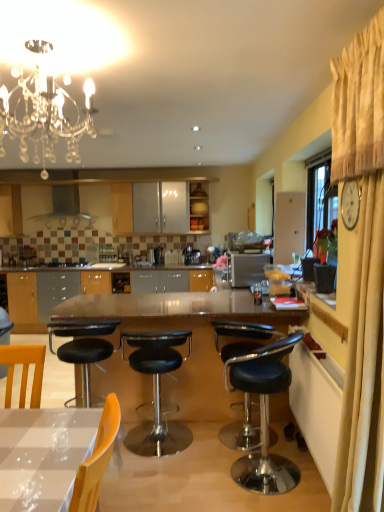
Question: Is satin silver coffee machine at center completely or partially inside satin silver range hood at upper center?

Choices:
 (A) yes
 (B) no

Answer: (B)

Question: Can you see satin silver range hood at upper center touching satin silver coffee machine at center?

Choices:
 (A) no
 (B) yes

Answer: (A)

Question: Does satin silver range hood at upper center appear on the left side of satin silver coffee machine at center?

Choices:
 (A) no
 (B) yes

Answer: (B)

Question: From the image's perspective, would you say satin silver range hood at upper center is shown under satin silver coffee machine at center?

Choices:
 (A) yes
 (B) no

Answer: (B)

Question: Does satin silver range hood at upper center come in front of satin silver coffee machine at center?

Choices:
 (A) no
 (B) yes

Answer: (B)

Question: Is point [x=241, y=262] closer or farther from the camera than point [x=190, y=184]?

Choices:
 (A) farther
 (B) closer

Answer: (B)

Question: Considering the positions of satin silver toaster at center and matte wood cabinet at center in the image, is satin silver toaster at center taller or shorter than matte wood cabinet at center?

Choices:
 (A) tall
 (B) short

Answer: (B)

Question: Choose the correct answer: Is satin silver toaster at center inside matte wood cabinet at center or outside it?

Choices:
 (A) outside
 (B) inside

Answer: (A)

Question: From a real-world perspective, relative to matte wood cabinet at center, is satin silver toaster at center vertically above or below?

Choices:
 (A) below
 (B) above

Answer: (A)

Question: Choose the correct answer: Is beige fabric curtain at right inside satin silver coffee machine at center or outside it?

Choices:
 (A) inside
 (B) outside

Answer: (B)

Question: Considering the positions of beige fabric curtain at right and satin silver coffee machine at center in the image, is beige fabric curtain at right taller or shorter than satin silver coffee machine at center?

Choices:
 (A) tall
 (B) short

Answer: (A)

Question: Considering the positions of point (369, 393) and point (182, 253), is point (369, 393) closer or farther from the camera than point (182, 253)?

Choices:
 (A) farther
 (B) closer

Answer: (B)

Question: In the image, is beige fabric curtain at right positioned in front of or behind satin silver coffee machine at center?

Choices:
 (A) front
 (B) behind

Answer: (A)

Question: Considering the positions of beige fabric curtain at right and satin silver toaster at center in the image, is beige fabric curtain at right taller or shorter than satin silver toaster at center?

Choices:
 (A) short
 (B) tall

Answer: (B)

Question: From the image's perspective, is beige fabric curtain at right located above or below satin silver toaster at center?

Choices:
 (A) above
 (B) below

Answer: (B)